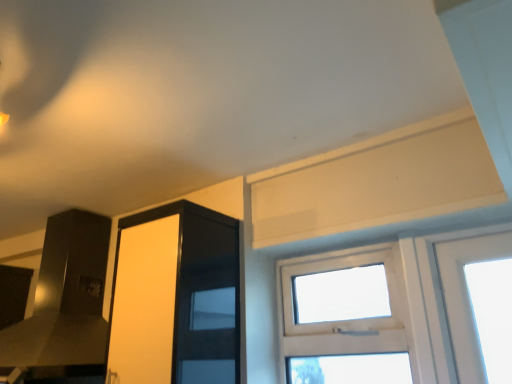
Question: Looking at the image, does transparent glass window at center seem bigger or smaller compared to transparent glass screen door at upper left?

Choices:
 (A) big
 (B) small

Answer: (B)

Question: Visually, is transparent glass window at center positioned to the left or to the right of transparent glass screen door at upper left?

Choices:
 (A) right
 (B) left

Answer: (A)

Question: From the image's perspective, is transparent glass window at center above or below transparent glass screen door at upper left?

Choices:
 (A) below
 (B) above

Answer: (A)

Question: Looking at the image, does transparent glass screen door at upper left seem bigger or smaller compared to transparent glass window at center?

Choices:
 (A) big
 (B) small

Answer: (A)

Question: Considering the positions of transparent glass screen door at upper left and transparent glass window at center in the image, is transparent glass screen door at upper left taller or shorter than transparent glass window at center?

Choices:
 (A) tall
 (B) short

Answer: (A)

Question: Is point (189, 365) closer or farther from the camera than point (389, 327)?

Choices:
 (A) closer
 (B) farther

Answer: (A)

Question: Is transparent glass screen door at upper left spatially inside transparent glass window at center, or outside of it?

Choices:
 (A) inside
 (B) outside

Answer: (B)